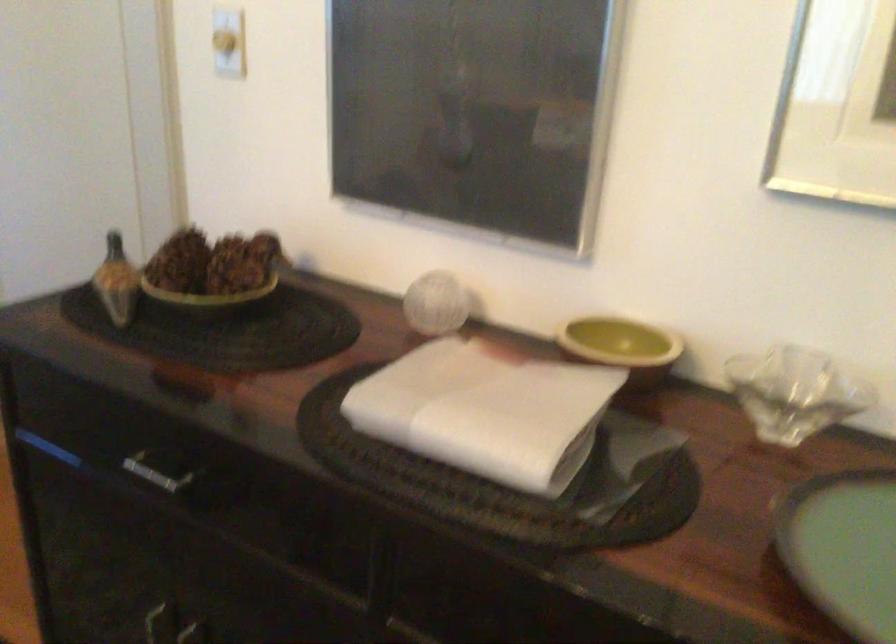
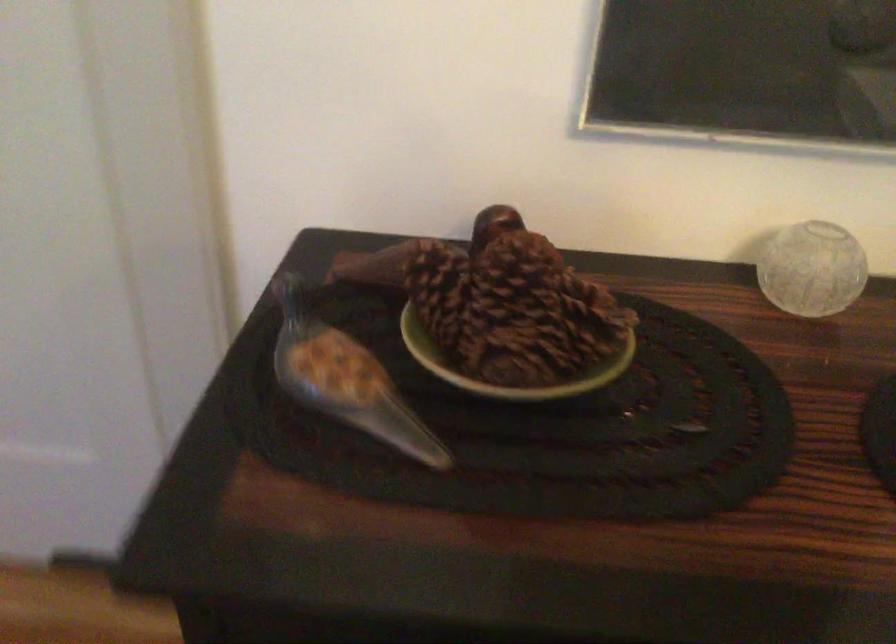
Question: The camera is either moving clockwise (left) or counter-clockwise (right) around the object. The first image is from the beginning of the video and the second image is from the end. Is the camera moving left or right when shooting the video?

Choices:
 (A) Left
 (B) Right

Answer: (A)